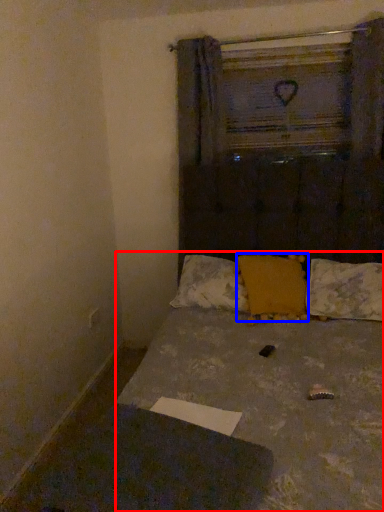
Question: Which point is closer to the camera, bed (highlighted by a red box) or pillow (highlighted by a blue box)?

Choices:
 (A) bed
 (B) pillow

Answer: (A)